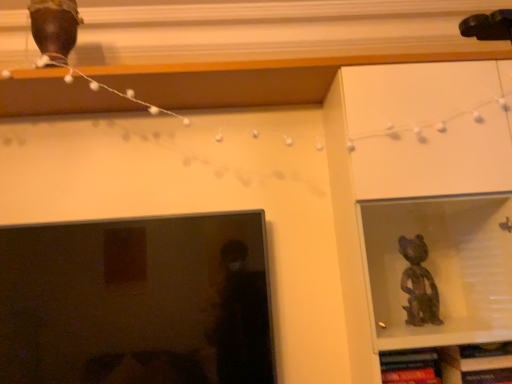
Question: Is matte black tv at left further to camera compared to wooden bookshelf at lower right?

Choices:
 (A) no
 (B) yes

Answer: (A)

Question: Can wooden bookshelf at lower right be found inside matte black tv at left?

Choices:
 (A) yes
 (B) no

Answer: (B)

Question: Is matte black tv at left thinner than wooden bookshelf at lower right?

Choices:
 (A) no
 (B) yes

Answer: (B)

Question: Considering the relative positions of matte black tv at left and wooden bookshelf at lower right in the image provided, is matte black tv at left to the left of wooden bookshelf at lower right from the viewer's perspective?

Choices:
 (A) yes
 (B) no

Answer: (A)

Question: Considering the relative positions of matte black tv at left and wooden bookshelf at lower right in the image provided, is matte black tv at left to the right of wooden bookshelf at lower right from the viewer's perspective?

Choices:
 (A) yes
 (B) no

Answer: (B)

Question: Considering the relative sizes of matte black tv at left and wooden bookshelf at lower right in the image provided, is matte black tv at left taller than wooden bookshelf at lower right?

Choices:
 (A) no
 (B) yes

Answer: (B)

Question: Is wooden bookshelf at lower right next to matte black tv at left?

Choices:
 (A) no
 (B) yes

Answer: (A)

Question: Does wooden bookshelf at lower right come in front of matte black tv at left?

Choices:
 (A) no
 (B) yes

Answer: (A)

Question: Considering the relative sizes of wooden bookshelf at lower right and matte black tv at left in the image provided, is wooden bookshelf at lower right shorter than matte black tv at left?

Choices:
 (A) yes
 (B) no

Answer: (A)

Question: From the image's perspective, does wooden bookshelf at lower right appear higher than matte black tv at left?

Choices:
 (A) yes
 (B) no

Answer: (B)

Question: Could you tell me if wooden bookshelf at lower right is turned towards matte black tv at left?

Choices:
 (A) no
 (B) yes

Answer: (A)

Question: From a real-world perspective, does wooden bookshelf at lower right sit lower than matte black tv at left?

Choices:
 (A) no
 (B) yes

Answer: (B)

Question: Is wooden bookshelf at lower right in front of or behind matte black tv at left in the image?

Choices:
 (A) front
 (B) behind

Answer: (B)